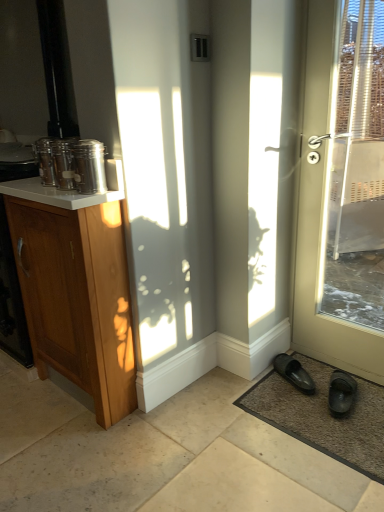
At what (x,y) coordinates should I click in order to perform the action: click on free space above brown textured mat at lower right (from a real-world perspective). Please return your answer as a coordinate pair (x, y). The image size is (384, 512). Looking at the image, I should click on (321, 394).